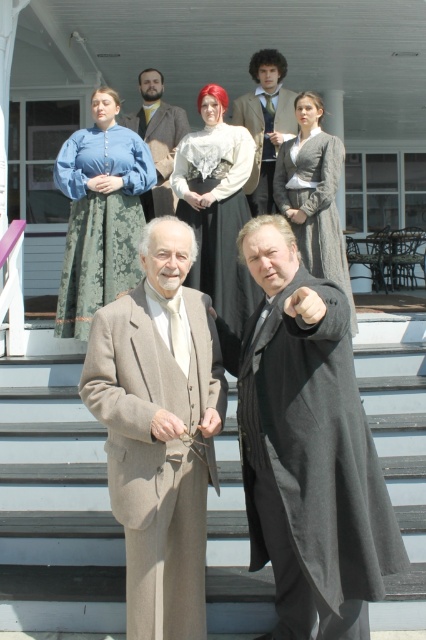
You are a photographer setting up a shoot in this historical scene. You need to position a spotlight to the left of the gray wool dress at center and another to the right of the brown wool suit at upper center. Will the spotlights overlap if placed as described?

The gray wool dress at center is to the right of the brown wool suit at upper center. Placing a spotlight to the left of the gray wool dress and another to the right of the brown wool suit would mean the first spotlight is on the right side of the brown wool suit and the second is to the right of the brown wool suit. Since the gray wool dress is already to the right of the brown wool suit, the spotlights would overlap between them.